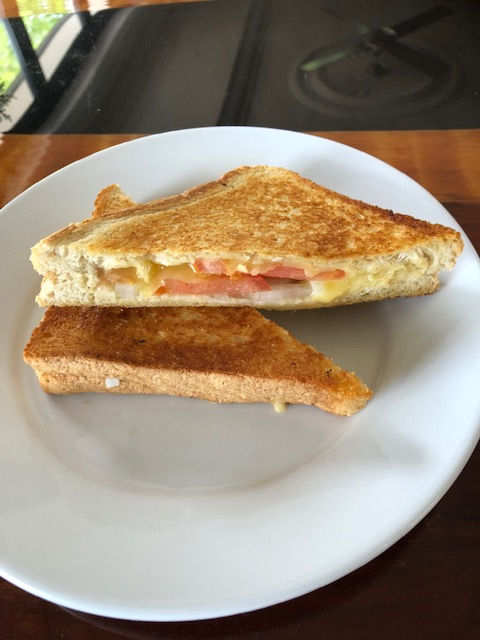
The height and width of the screenshot is (640, 480). What are the coordinates of `window` in the screenshot? It's located at (45, 33), (8, 68).